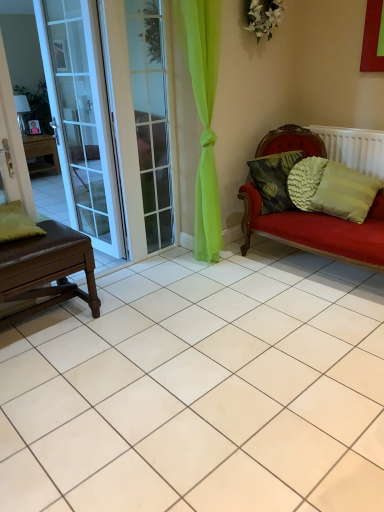
Question: Does green matte pillow at left, the fourth pillow in the right-to-left sequence, have a greater width compared to white glass door at left?

Choices:
 (A) yes
 (B) no

Answer: (A)

Question: From a real-world perspective, is green matte pillow at left, placed as the first pillow when sorted from left to right, beneath white glass door at left?

Choices:
 (A) no
 (B) yes

Answer: (B)

Question: Can you confirm if green matte pillow at left, placed as the first pillow when sorted from left to right, is shorter than white glass door at left?

Choices:
 (A) no
 (B) yes

Answer: (B)

Question: Does green matte pillow at left, placed as the first pillow when sorted from left to right, have a lesser width compared to white glass door at left?

Choices:
 (A) yes
 (B) no

Answer: (B)

Question: Does green matte pillow at left, the fourth pillow in the right-to-left sequence, have a greater height compared to white glass door at left?

Choices:
 (A) no
 (B) yes

Answer: (A)

Question: From the image's perspective, is green matte pillow at left, placed as the first pillow when sorted from left to right, under white glass door at left?

Choices:
 (A) no
 (B) yes

Answer: (B)

Question: Does green textured pillow at right, positioned as the 4th pillow in left-to-right order, have a larger size compared to white plastic radiator at right?

Choices:
 (A) yes
 (B) no

Answer: (A)

Question: Is the depth of green textured pillow at right, which ranks as the first pillow in right-to-left order, less than that of white plastic radiator at right?

Choices:
 (A) yes
 (B) no

Answer: (A)

Question: From a real-world perspective, is green textured pillow at right, positioned as the 4th pillow in left-to-right order, over white plastic radiator at right?

Choices:
 (A) no
 (B) yes

Answer: (A)

Question: Can you confirm if green textured pillow at right, which ranks as the first pillow in right-to-left order, is thinner than white plastic radiator at right?

Choices:
 (A) yes
 (B) no

Answer: (B)

Question: From the image's perspective, would you say green textured pillow at right, positioned as the 4th pillow in left-to-right order, is positioned over white plastic radiator at right?

Choices:
 (A) no
 (B) yes

Answer: (A)

Question: Is green textured pillow at right, which ranks as the first pillow in right-to-left order, with white plastic radiator at right?

Choices:
 (A) yes
 (B) no

Answer: (B)

Question: Is brown leather table at left aimed at textured green pillow at right, which is counted as the 2th pillow, starting from the right?

Choices:
 (A) no
 (B) yes

Answer: (A)